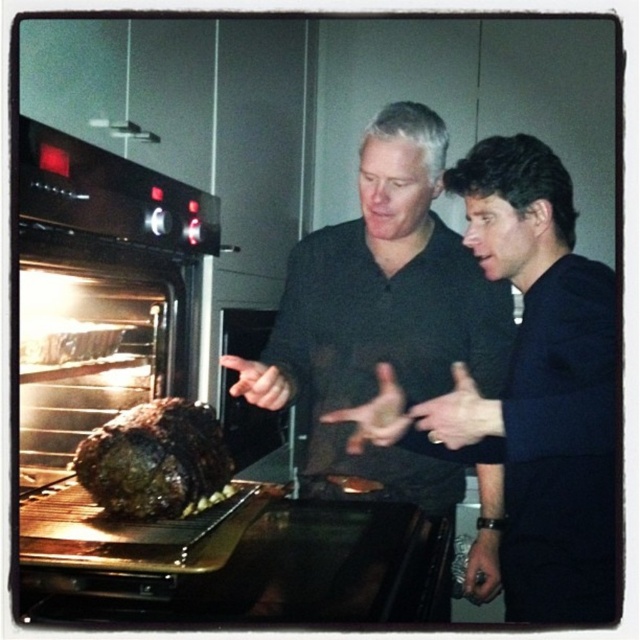
Between dark blue shirt at center and brown crispy turkey at center, which one appears on the right side from the viewer's perspective?

dark blue shirt at center is more to the right.

Which is more to the left, dark blue shirt at center or brown crispy turkey at center?

brown crispy turkey at center is more to the left.

Where is `dark blue shirt at center`? Image resolution: width=640 pixels, height=640 pixels. dark blue shirt at center is located at coordinates (541, 385).

Identify the location of dark blue shirt at center. This screenshot has width=640, height=640. (541, 385).

Is black glass oven at left wider than brown crispy turkey at center?

Correct, the width of black glass oven at left exceeds that of brown crispy turkey at center.

Can you confirm if black glass oven at left is bigger than brown crispy turkey at center?

Yes, black glass oven at left is bigger than brown crispy turkey at center.

The width and height of the screenshot is (640, 640). Describe the element at coordinates (106, 355) in the screenshot. I see `black glass oven at left` at that location.

At what (x,y) coordinates should I click in order to perform the action: click on black glass oven at left. Please return your answer as a coordinate pair (x, y). The width and height of the screenshot is (640, 640). Looking at the image, I should click on (106, 355).

How far apart are dark gray sweater at center and dark blue shirt at center?

They are 11.06 inches apart.

Can you confirm if dark gray sweater at center is smaller than dark blue shirt at center?

No.

Is point (353, 401) in front of point (536, 328)?

No, (353, 401) is behind (536, 328).

At what (x,y) coordinates should I click in order to perform the action: click on dark gray sweater at center. Please return your answer as a coordinate pair (x, y). Looking at the image, I should click on (381, 314).